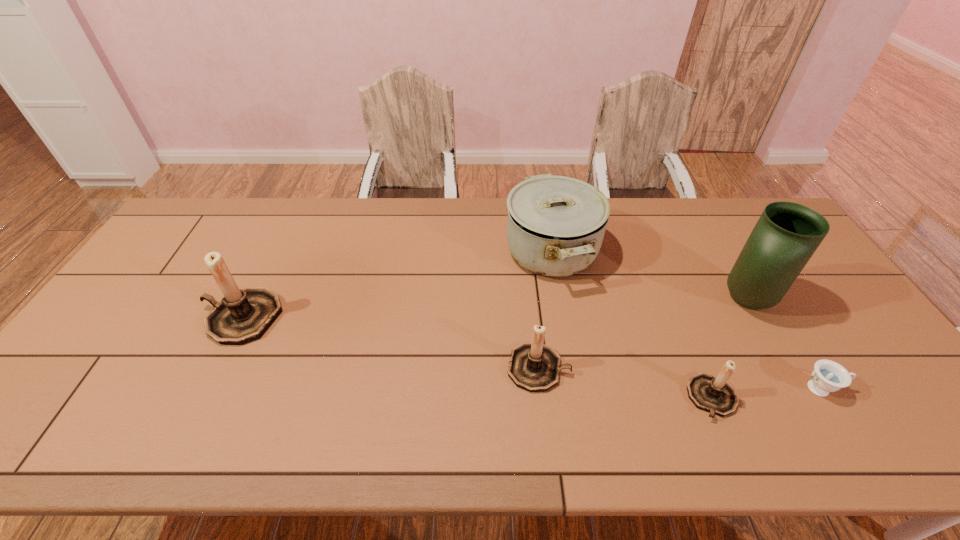
Locate an element on the screen. This screenshot has width=960, height=540. vacant point located on the back of the shortest candle holder is located at coordinates (669, 295).

At what (x,y) coordinates should I click in order to perform the action: click on free space located on the left of the saucepan. Please return your answer as a coordinate pair (x, y). The width and height of the screenshot is (960, 540). Looking at the image, I should click on (458, 252).

Image resolution: width=960 pixels, height=540 pixels. In order to click on vacant space positioned 0.160m on the side of the shortest object with the handle in this screenshot , I will do `click(909, 388)`.

Where is `vacant position located 0.070m on the right of the tallest object`? This screenshot has width=960, height=540. vacant position located 0.070m on the right of the tallest object is located at coordinates (803, 300).

Find the location of a particular element. Image resolution: width=960 pixels, height=540 pixels. object at the far edge is located at coordinates (556, 224).

Identify the location of teacup that is positioned at the near edge. The width and height of the screenshot is (960, 540). (828, 376).

This screenshot has height=540, width=960. I want to click on object that is positioned at the right edge, so click(828, 376).

Find the location of a particular element. The image size is (960, 540). object present at the near right corner is located at coordinates (828, 376).

I want to click on vacant space at the far edge, so pos(220,237).

Identify the location of free spot at the near edge of the desktop. (232, 410).